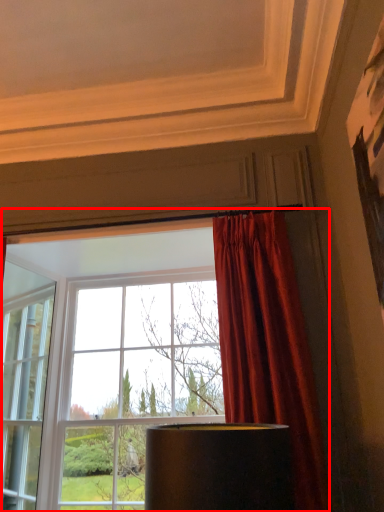
Question: In this image, where is window (annotated by the red box) located relative to curtain?

Choices:
 (A) right
 (B) left

Answer: (B)